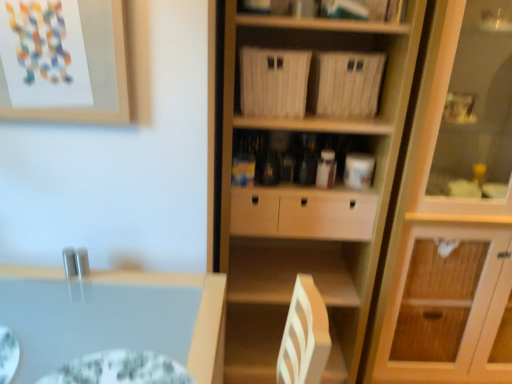
Where is `matte paper picture frame at upper left`? The width and height of the screenshot is (512, 384). matte paper picture frame at upper left is located at coordinates (93, 70).

Based on the photo, what is the approximate width of matte paper picture frame at upper left?

matte paper picture frame at upper left is 1.44 inches in width.

You are a GUI agent. You are given a task and a screenshot of the screen. Output one action in this format:
    pyautogui.click(x=<x>, y=<y>)
    Task: Click on the wooden cupboard at center
    Image resolution: width=512 pixels, height=384 pixels.
    Given the screenshot: What is the action you would take?
    pyautogui.click(x=384, y=206)

Locate an element on the screen. cabinetry behind the green textured glass plate at lower left is located at coordinates (453, 211).

From the image's perspective, would you say light wood cabinet at right is shown under green textured glass plate at lower left?

Incorrect, from the image's perspective, light wood cabinet at right is higher than green textured glass plate at lower left.

Is light wood cabinet at right surrounding green textured glass plate at lower left?

No, green textured glass plate at lower left is not inside light wood cabinet at right.

Which object is further away from the camera taking this photo, light wood cabinet at right or green textured glass plate at lower left?

light wood cabinet at right is further from the camera.

Would you say matte paper picture frame at upper left is outside light wood cabinet at right?

Yes, matte paper picture frame at upper left is not within light wood cabinet at right.

Between matte paper picture frame at upper left and light wood cabinet at right, which one has less height?

matte paper picture frame at upper left is shorter.

Is matte paper picture frame at upper left to the left of light wood cabinet at right from the viewer's perspective?

Yes, matte paper picture frame at upper left is to the left of light wood cabinet at right.

From the image's perspective, between matte paper picture frame at upper left and light wood cabinet at right, which one is located above?

From the image's view, matte paper picture frame at upper left is above.

Is green textured glass plate at lower left oriented towards wooden cupboard at center?

No, green textured glass plate at lower left is not oriented towards wooden cupboard at center.

From the image's perspective, is green textured glass plate at lower left below wooden cupboard at center?

Yes.

Does green textured glass plate at lower left touch wooden cupboard at center?

green textured glass plate at lower left and wooden cupboard at center are clearly separated.

At what (x,y) coordinates should I click in order to perform the action: click on glass plate in front of the wooden cupboard at center. Please return your answer as a coordinate pair (x, y). This screenshot has width=512, height=384. Looking at the image, I should click on (120, 369).

Does light wood cabinet at right contain matte paper picture frame at upper left?

Definitely not — matte paper picture frame at upper left is not inside light wood cabinet at right.

How distant is light wood cabinet at right from matte paper picture frame at upper left?

The distance of light wood cabinet at right from matte paper picture frame at upper left is 1.17 meters.

Considering the relative positions of light wood cabinet at right and matte paper picture frame at upper left in the image provided, is light wood cabinet at right to the left or to the right of matte paper picture frame at upper left?

Clearly, light wood cabinet at right is on the right of matte paper picture frame at upper left in the image.

From the image's perspective, is light wood cabinet at right located above or below matte paper picture frame at upper left?

From the image's perspective, light wood cabinet at right appears below matte paper picture frame at upper left.

Considering the sizes of objects green textured glass plate at lower left and light wood cabinet at right in the image provided, who is smaller, green textured glass plate at lower left or light wood cabinet at right?

Smaller between the two is green textured glass plate at lower left.

From the image's perspective, which object appears higher, green textured glass plate at lower left or light wood cabinet at right?

From the image's view, light wood cabinet at right is above.

From a real-world perspective, is green textured glass plate at lower left physically located above or below light wood cabinet at right?

From a real-world perspective, green textured glass plate at lower left is physically below light wood cabinet at right.

The height and width of the screenshot is (384, 512). I want to click on cabinetry that is behind the green textured glass plate at lower left, so click(453, 211).

From a real-world perspective, is wooden cupboard at center located higher than green textured glass plate at lower left?

Yes, from a real-world perspective, wooden cupboard at center is over green textured glass plate at lower left

Can we say wooden cupboard at center lies outside green textured glass plate at lower left?

Yes.

Are wooden cupboard at center and green textured glass plate at lower left located far from each other?

wooden cupboard at center is far away from green textured glass plate at lower left.

Can you confirm if wooden cupboard at center is bigger than green textured glass plate at lower left?

Indeed, wooden cupboard at center has a larger size compared to green textured glass plate at lower left.

Is matte paper picture frame at upper left located within green textured glass plate at lower left?

Actually, matte paper picture frame at upper left is outside green textured glass plate at lower left.

This screenshot has width=512, height=384. I want to click on picture frame behind the green textured glass plate at lower left, so click(93, 70).

Visually, is green textured glass plate at lower left positioned to the left or to the right of matte paper picture frame at upper left?

Clearly, green textured glass plate at lower left is on the right of matte paper picture frame at upper left in the image.

Which of these two, green textured glass plate at lower left or matte paper picture frame at upper left, stands shorter?

green textured glass plate at lower left.

Locate an element on the screen. This screenshot has height=384, width=512. glass plate in front of the light wood cabinet at right is located at coordinates (120, 369).

In order to click on cabinetry on the right of the matte paper picture frame at upper left in this screenshot , I will do coord(453,211).

Based on their spatial positions, is wooden cupboard at center or matte paper picture frame at upper left closer to light wood cabinet at right?

Based on the image, wooden cupboard at center appears to be nearer to light wood cabinet at right.

Considering their positions, is wooden cupboard at center positioned further to green textured glass plate at lower left than matte paper picture frame at upper left?

Based on the image, wooden cupboard at center appears to be further to green textured glass plate at lower left.

Based on their spatial positions, is green textured glass plate at lower left or light wood cabinet at right closer to wooden cupboard at center?

Based on the image, light wood cabinet at right appears to be nearer to wooden cupboard at center.

Looking at the image, which one is located closer to green textured glass plate at lower left, light wood cabinet at right or wooden cupboard at center?

wooden cupboard at center is closer to green textured glass plate at lower left.

Based on their spatial positions, is wooden cupboard at center or light wood cabinet at right closer to green textured glass plate at lower left?

wooden cupboard at center is positioned closer to the anchor green textured glass plate at lower left.

Considering their positions, is matte paper picture frame at upper left positioned further to green textured glass plate at lower left than wooden cupboard at center?

wooden cupboard at center is further to green textured glass plate at lower left.

Considering their positions, is green textured glass plate at lower left positioned further to light wood cabinet at right than matte paper picture frame at upper left?

green textured glass plate at lower left is positioned further to the anchor light wood cabinet at right.

From the picture: Which object lies further to the anchor point matte paper picture frame at upper left, light wood cabinet at right or wooden cupboard at center?

light wood cabinet at right is positioned further to the anchor matte paper picture frame at upper left.

Find the location of `cupboard between matte paper picture frame at upper left and green textured glass plate at lower left from top to bottom`. cupboard between matte paper picture frame at upper left and green textured glass plate at lower left from top to bottom is located at coordinates (384, 206).

The height and width of the screenshot is (384, 512). Find the location of `cupboard located between green textured glass plate at lower left and light wood cabinet at right in the left-right direction`. cupboard located between green textured glass plate at lower left and light wood cabinet at right in the left-right direction is located at coordinates (384, 206).

Where is `glass plate between matte paper picture frame at upper left and light wood cabinet at right from left to right`? The width and height of the screenshot is (512, 384). glass plate between matte paper picture frame at upper left and light wood cabinet at right from left to right is located at coordinates (120, 369).

This screenshot has width=512, height=384. I want to click on cupboard located between matte paper picture frame at upper left and light wood cabinet at right in the left-right direction, so click(x=384, y=206).